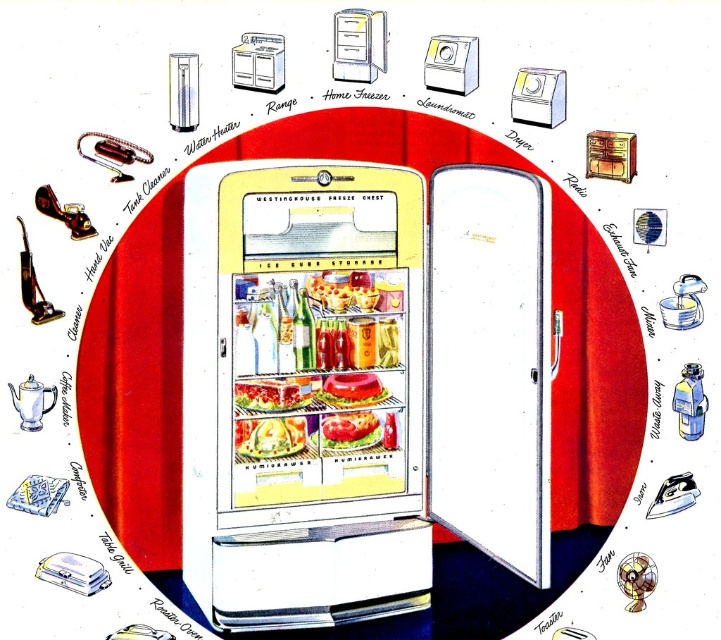
You are a chef preparing to place the shiny plastic sandwich at center onto the matte yellow refrigerator at center. Considering their sizes, will the sandwich fit on top of the refrigerator?

The matte yellow refrigerator at center is taller than the shiny plastic sandwich at center, so the sandwich will fit on top of the matte yellow refrigerator at center since it is shorter in height.

You are trying to place a new item into the yellow matte refrigerator at center. The item is exactly the same width as the translucent plastic container at center. Will the item fit inside the refrigerator?

The yellow matte refrigerator at center might be wider than translucent plastic container at center, so the item with the same width as the translucent plastic container at center might fit inside the yellow matte refrigerator at center. However, since the exact width of the refrigerator isn not specified, there is some uncertainty.